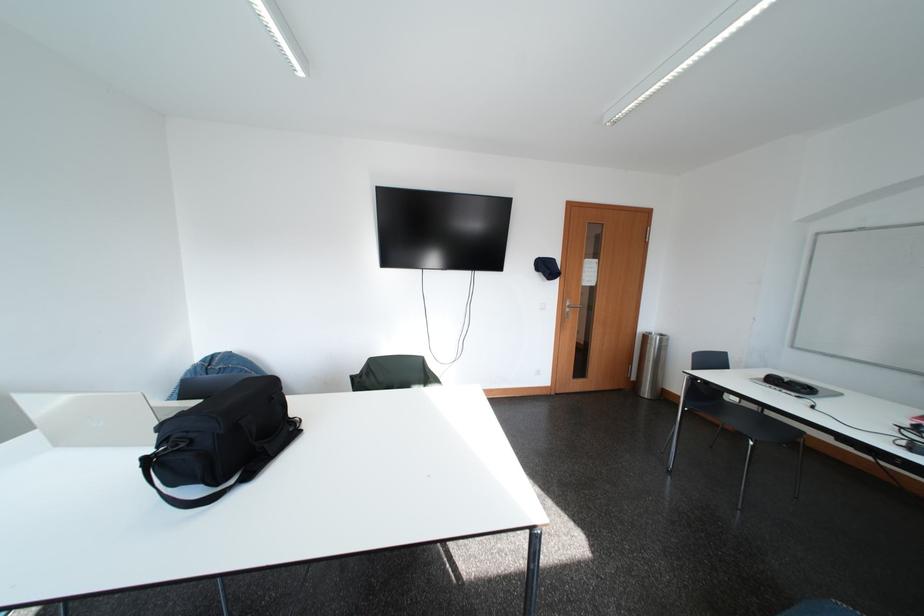
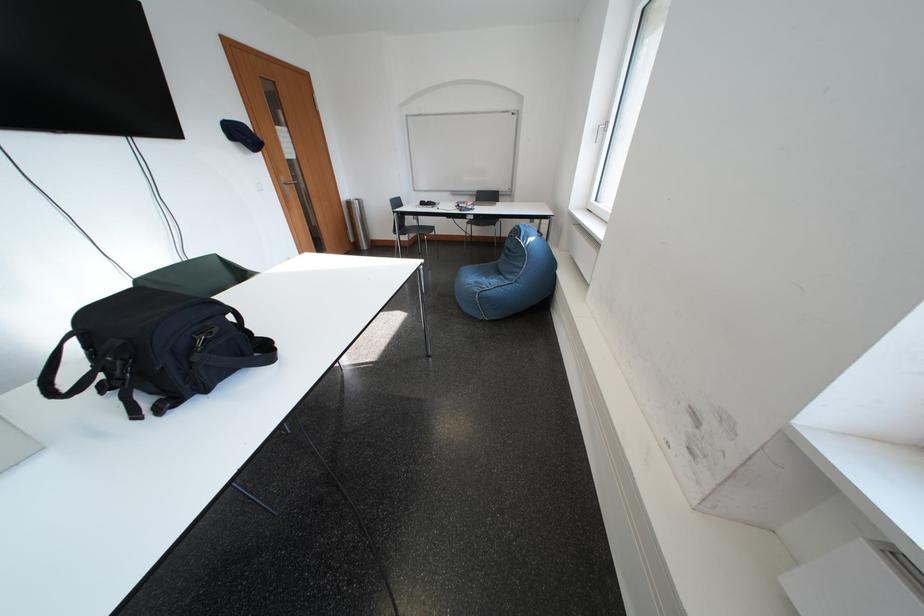
Locate, in the second image, the point that corresponds to the point at 657,341 in the first image.

(360, 207)